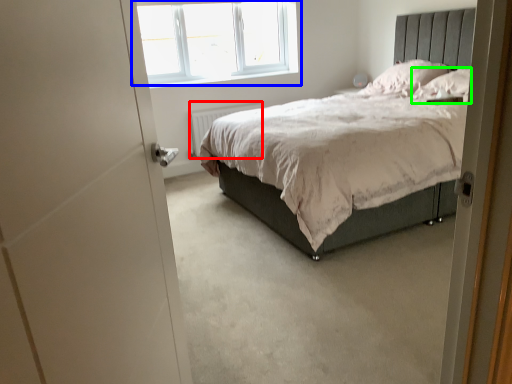
Question: Which object is positioned farthest from radiator (highlighted by a red box)? Select from window (highlighted by a blue box) and pillow (highlighted by a green box).

Choices:
 (A) window
 (B) pillow

Answer: (B)